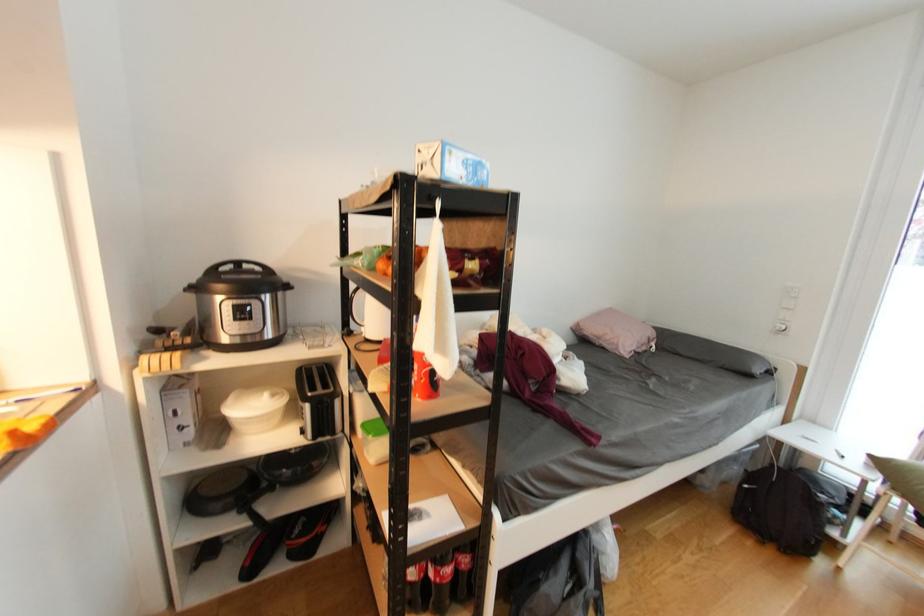
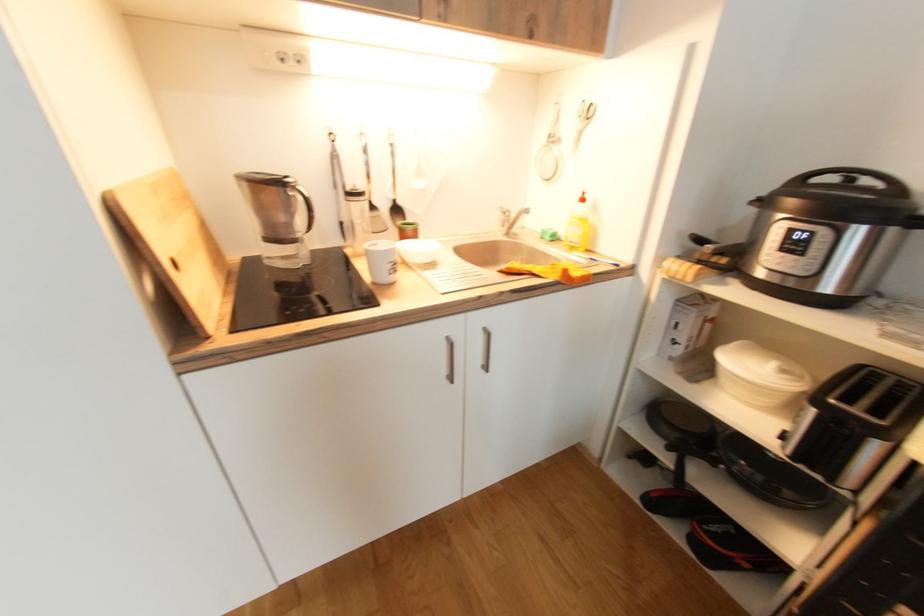
First-person continuous shooting, in which direction is the camera rotating?

The camera's rotation is toward left-down.